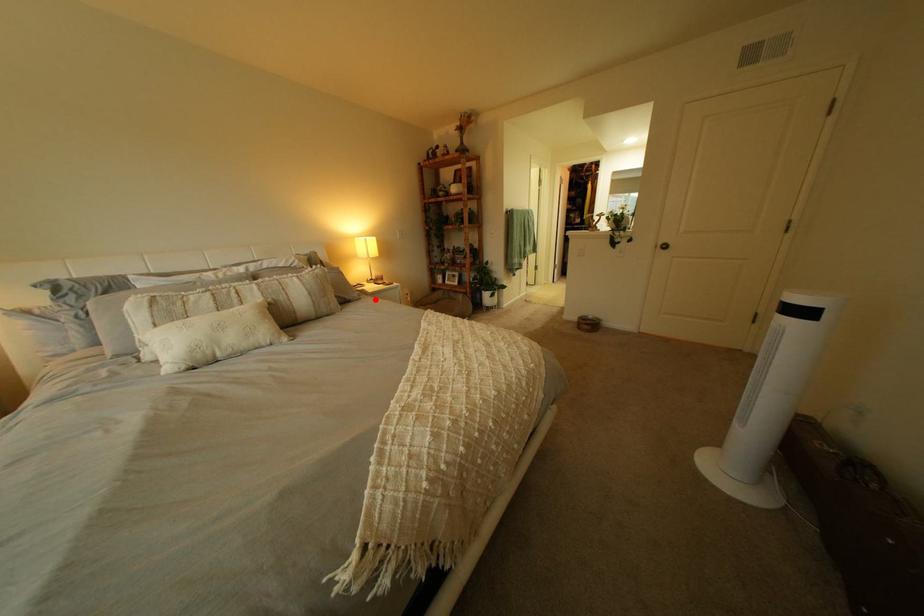
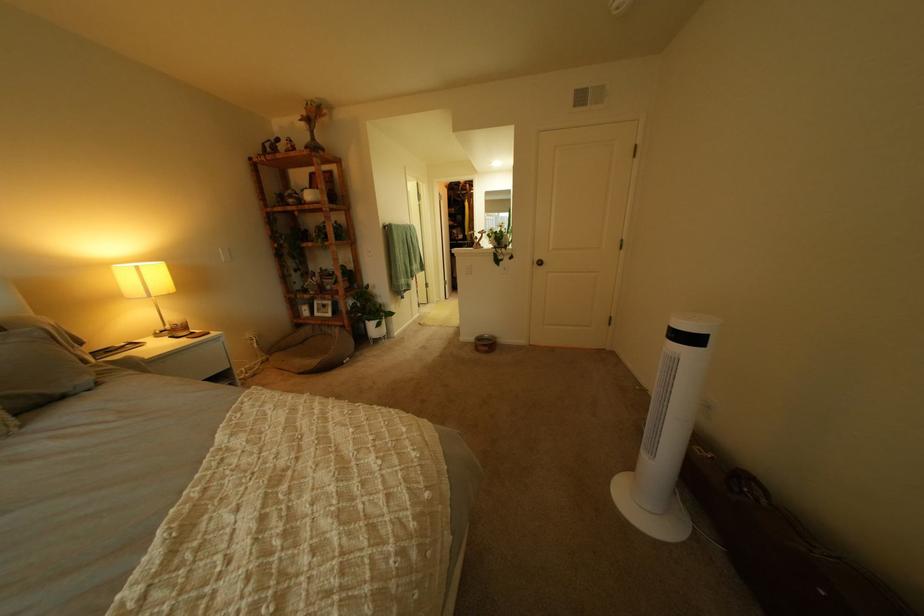
Locate, in the second image, the point that corresponds to the highlighted location in the first image.

(115, 385)